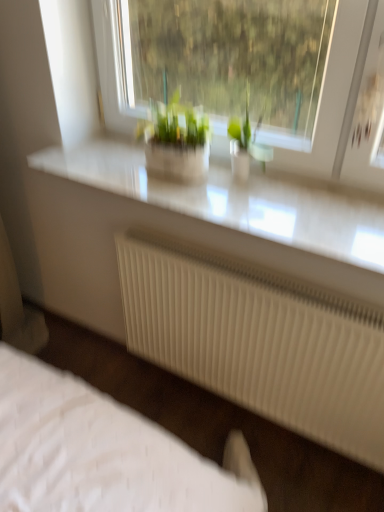
You are a GUI agent. You are given a task and a screenshot of the screen. Output one action in this format:
    pyautogui.click(x=<x>, y=<y>)
    Task: Click on the blank space situated above white quilted bed at lower left (from a real-world perspective)
    This screenshot has height=512, width=384.
    Given the screenshot: What is the action you would take?
    pyautogui.click(x=155, y=388)